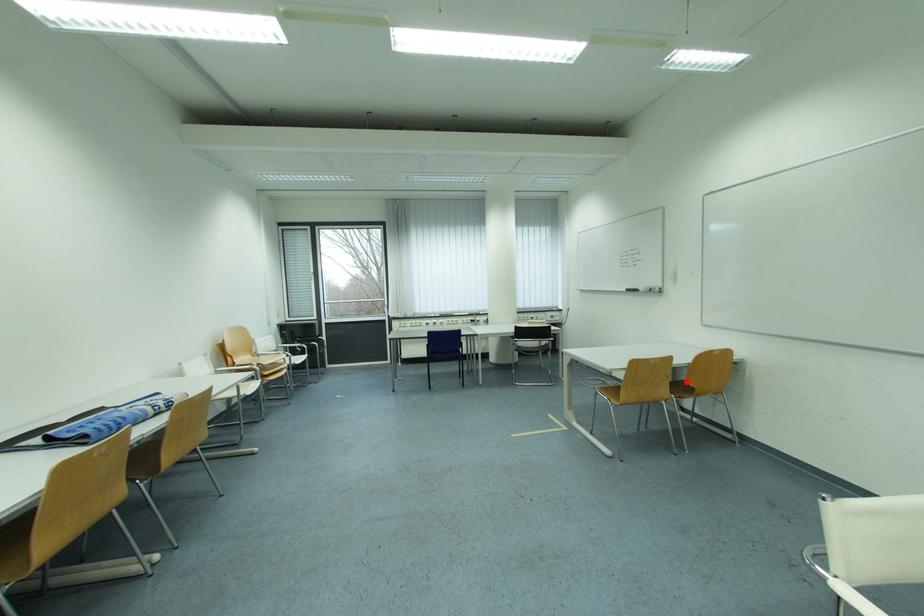
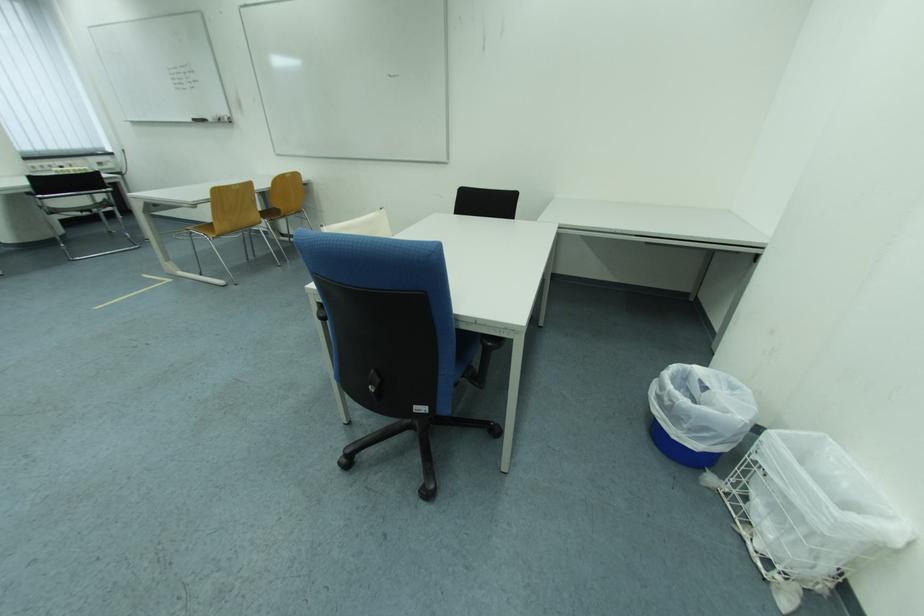
Question: I am providing you with two images of the same scene from different viewpoints. Image1 has a red point marked. In image2, the corresponding 3D location appears at what relative position? Reply with the corresponding letter.

Choices:
 (A) Closer
 (B) Farther

Answer: (A)